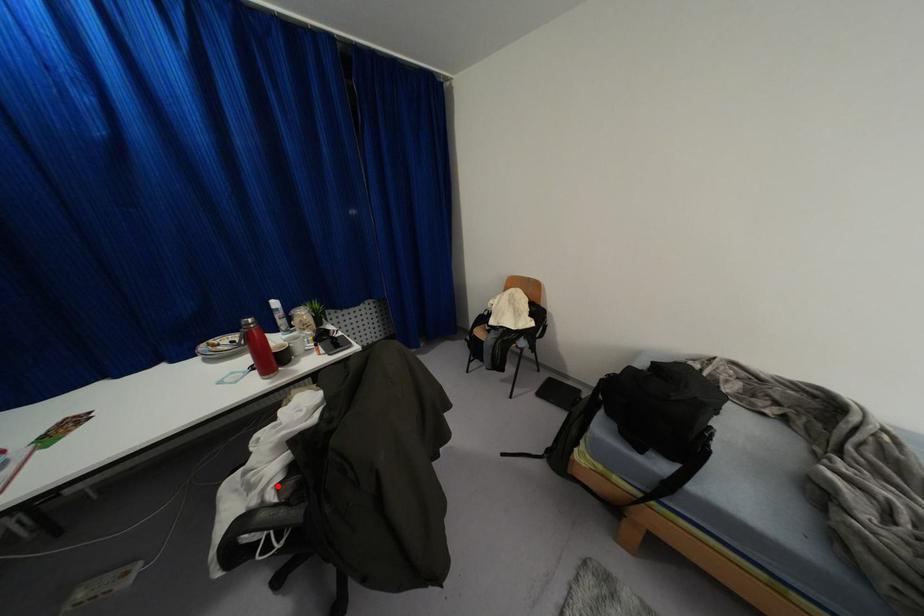
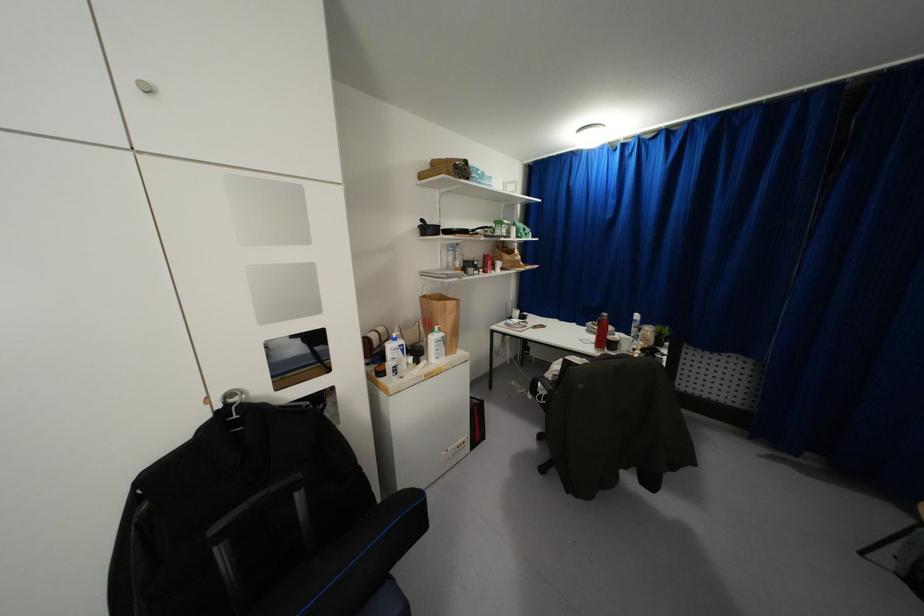
Locate, in the second image, the point that corresponds to the highlighted location in the first image.

(553, 376)